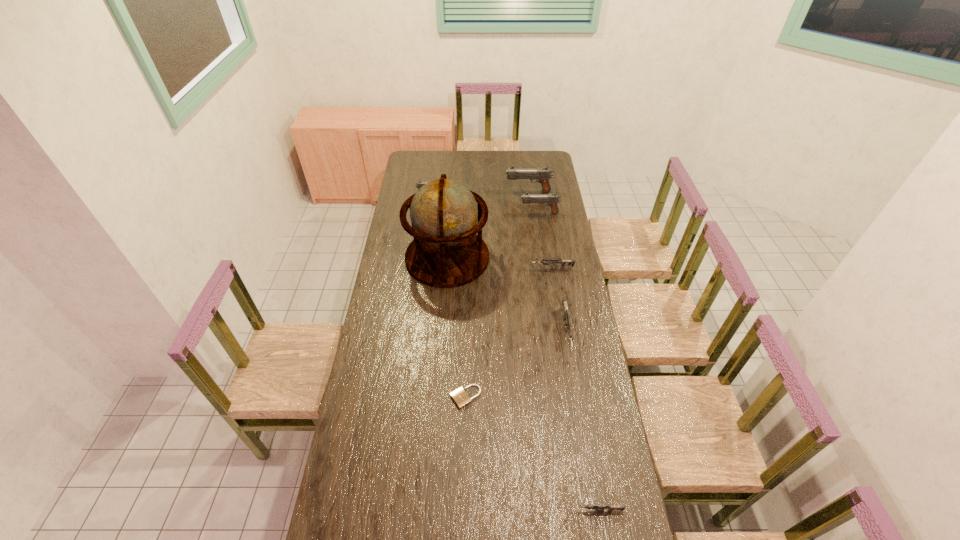
Find the location of a particular element. unoccupied position between the second smallest gray gun and the smallest grey gun is located at coordinates (568, 362).

I want to click on vacant area that lies between the second biggest gray gun and the second biggest grey gun, so click(545, 240).

This screenshot has width=960, height=540. I want to click on blank region between the third tallest gun and the second nearest object, so click(x=448, y=296).

Locate an element on the screen. The height and width of the screenshot is (540, 960). free space between the farthest gun and the nearest grey gun is located at coordinates (563, 351).

Where is `empty space between the second farthest gray gun and the fifth farthest gun`? The height and width of the screenshot is (540, 960). empty space between the second farthest gray gun and the fifth farthest gun is located at coordinates (499, 263).

Locate which object ranks seventh in proximity to the second shortest object. Please provide its 2D coordinates. Your answer should be formatted as a tuple, i.e. [(x, y)], where the tuple contains the x and y coordinates of a point satisfying the conditions above.

[(420, 183)]

The image size is (960, 540). I want to click on object that is the sixth closest to the farthest grey gun, so click(420, 183).

Select which gun is the fourth closest to the fourth tallest object. Please provide its 2D coordinates. Your answer should be formatted as a tuple, i.e. [(x, y)], where the tuple contains the x and y coordinates of a point satisfying the conditions above.

[(568, 325)]

You are a GUI agent. You are given a task and a screenshot of the screen. Output one action in this format:
    pyautogui.click(x=<x>, y=<y>)
    Task: Click on the gun that is the closest one to the farthest gun
    
    Given the screenshot: What is the action you would take?
    pyautogui.click(x=552, y=200)

Where is `the closest gray gun to the seventh farthest object`? The height and width of the screenshot is (540, 960). the closest gray gun to the seventh farthest object is located at coordinates (552, 200).